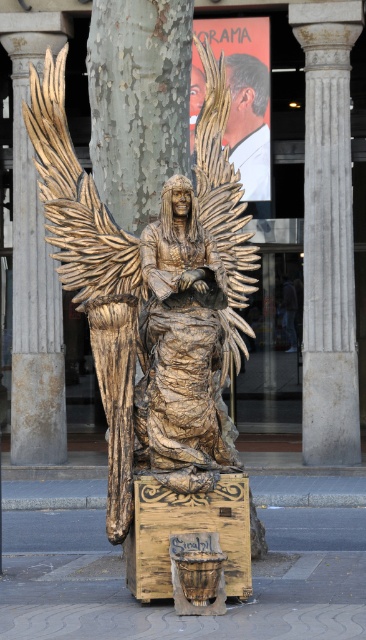
Can you confirm if wooden statue at center is bigger than white marble column at center?

No.

Is point (140, 397) positioned before point (341, 346)?

Yes, point (140, 397) is closer to viewer.

The height and width of the screenshot is (640, 366). Find the location of `wooden statue at center`. wooden statue at center is located at coordinates (152, 296).

What do you see at coordinates (152, 296) in the screenshot? Image resolution: width=366 pixels, height=640 pixels. I see `wooden statue at center` at bounding box center [152, 296].

Consider the image. How distant is wooden statue at center from smooth marble pillar at center?

The distance of wooden statue at center from smooth marble pillar at center is 62.06 feet.

Is point (117, 538) more distant than point (57, 32)?

No, (117, 538) is closer to viewer.

At what (x,y) coordinates should I click in order to perform the action: click on wooden statue at center. Please return your answer as a coordinate pair (x, y). This screenshot has width=366, height=640. Looking at the image, I should click on (152, 296).

In the scene shown: Does white marble column at center appear over smooth skin at upper center?

Incorrect, white marble column at center is not positioned above smooth skin at upper center.

Is point (323, 438) farther from viewer compared to point (254, 195)?

No, it is not.

Is point (326, 93) farther from viewer compared to point (237, 106)?

No, (326, 93) is in front of (237, 106).

The width and height of the screenshot is (366, 640). What are the coordinates of `white marble column at center` in the screenshot? It's located at (327, 234).